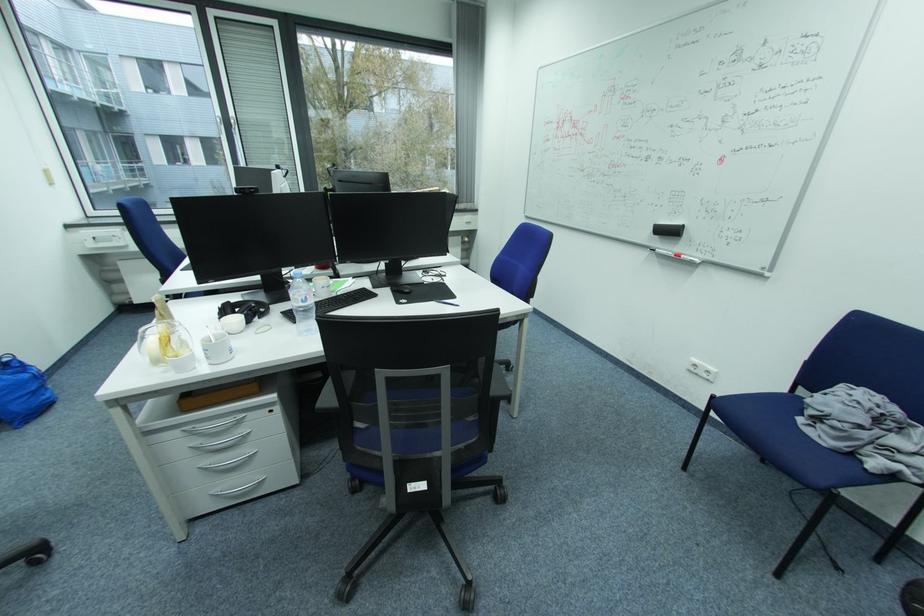
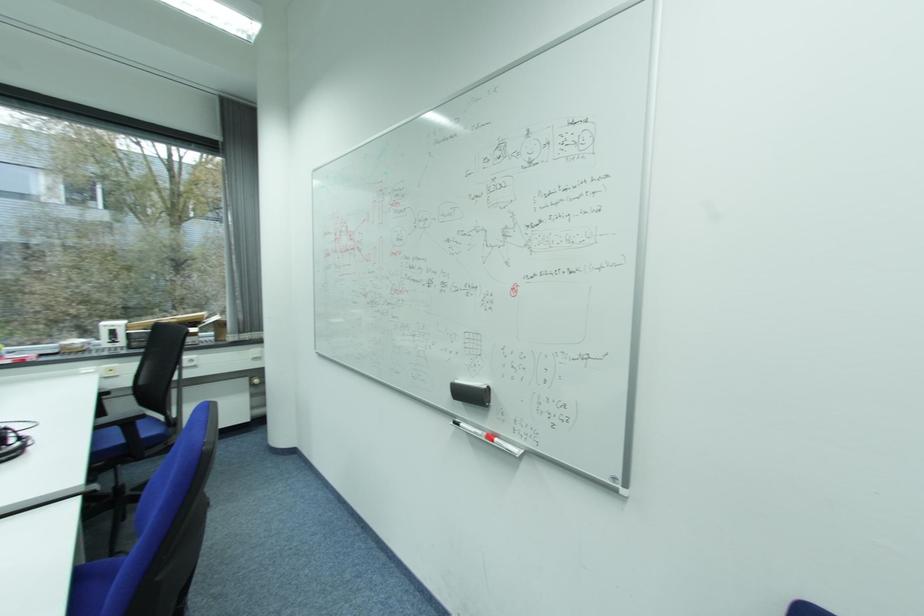
What movement of the cameraman would produce the second image?

The cameraman moved toward right, forward.